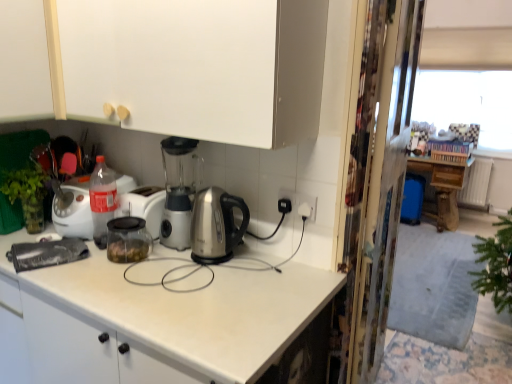
Question: Considering the positions of point (57, 211) and point (129, 44), is point (57, 211) closer or farther from the camera than point (129, 44)?

Choices:
 (A) closer
 (B) farther

Answer: (B)

Question: Would you say clear glass jar at center is to the left or to the right of white matte cabinet at upper center, acting as the second cabinetry starting from the left, in the picture?

Choices:
 (A) left
 (B) right

Answer: (A)

Question: Which object is the farthest from the white matte cabinet at upper center, arranged as the first cabinetry when viewed from the right?

Choices:
 (A) clear glass jar at center
 (B) transparent plastic window screen at upper right
 (C) transparent plastic screen door at right
 (D) white matte cabinet at upper left, arranged as the 2th cabinetry when viewed from the right
 (E) wooden table at right

Answer: (B)

Question: Considering the real-world distances, which object is closest to the clear glass jar at center?

Choices:
 (A) transparent plastic window screen at upper right
 (B) wooden table at right
 (C) transparent plastic screen door at right
 (D) white matte cabinet at upper left, arranged as the 2th cabinetry when viewed from the right
 (E) white matte cabinet at upper center, arranged as the first cabinetry when viewed from the right

Answer: (D)